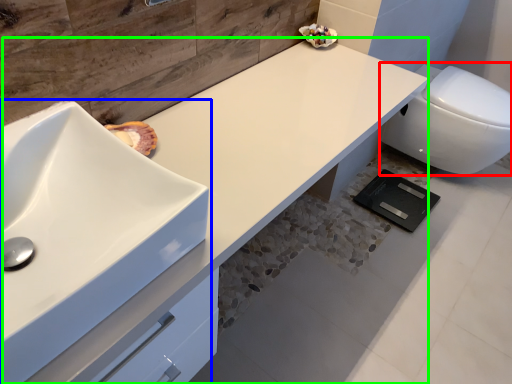
Question: Considering the real-world distances, which object is closest to toilet (highlighted by a red box)? sink (highlighted by a blue box) or counter top (highlighted by a green box).

Choices:
 (A) sink
 (B) counter top

Answer: (B)